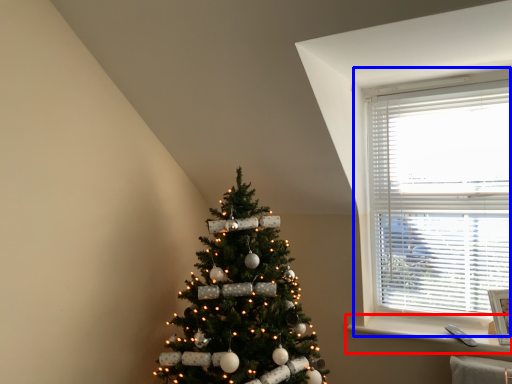
Question: Which object is further to the camera taking this photo, window sill (highlighted by a red box) or window (highlighted by a blue box)?

Choices:
 (A) window sill
 (B) window

Answer: (B)